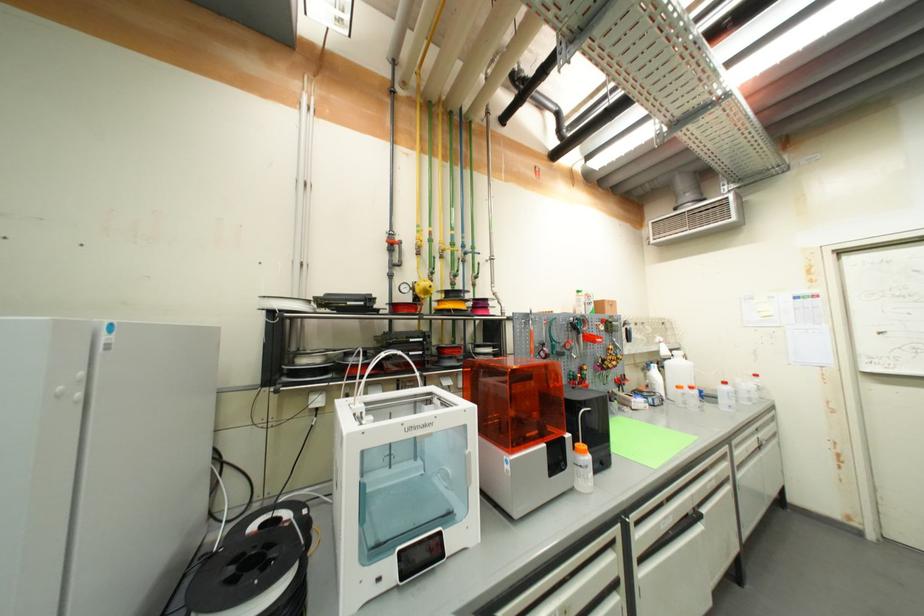
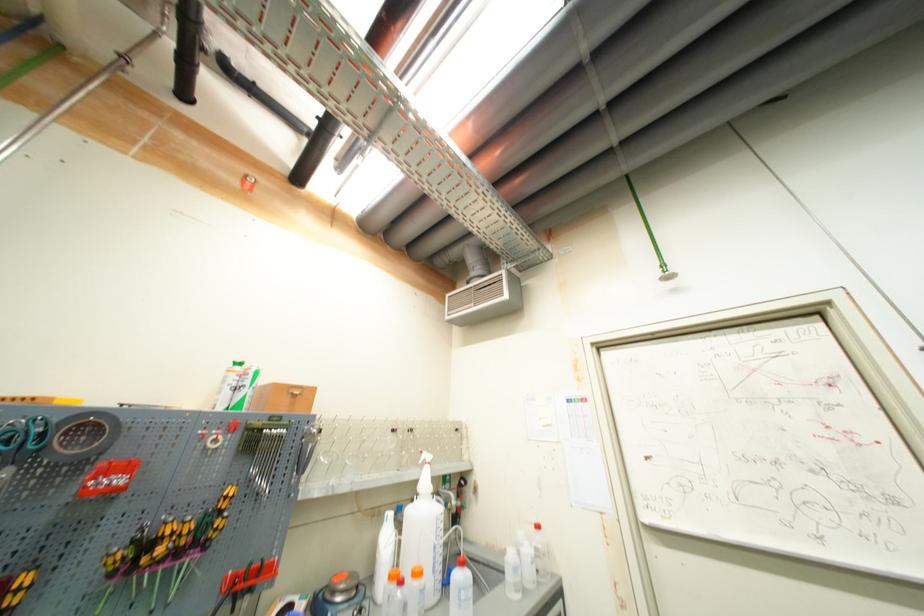
Find the pixel in the second image that matches [663,353] in the first image.

(421, 484)